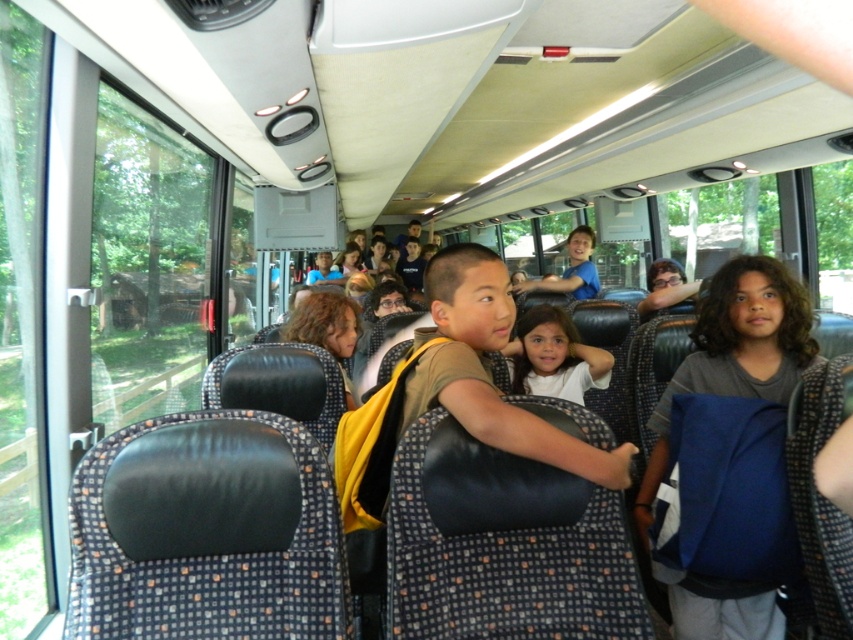
You are a bus driver and you need to locate two children for a safety check. The children are wearing a gray cotton shirt at right and a white matte shirt at center. Which child is positioned more to the right side of the bus?

The gray cotton shirt at right is positioned more to the right side of the bus compared to the white matte shirt at center.

You are a photographer taking a picture of the bus interior. You want to ensure both the gray cotton shirt at right and the white matte shirt at center are clearly visible in the photo. Based on their positions, which shirt might be more likely to block the other from view?

The gray cotton shirt at right is in front of the white matte shirt at center, so it may block part of the white matte shirt at center from view.